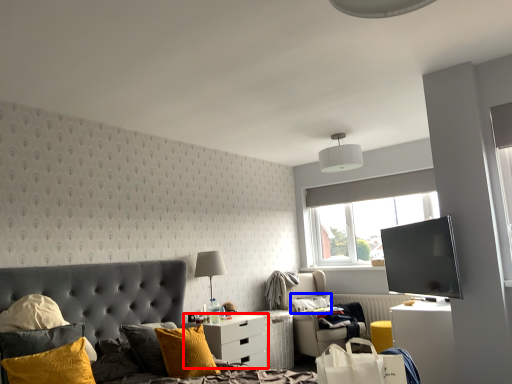
Question: Which of the following is the farthest to the observer, nightstand (highlighted by a red box) or pillow (highlighted by a blue box)?

Choices:
 (A) nightstand
 (B) pillow

Answer: (B)